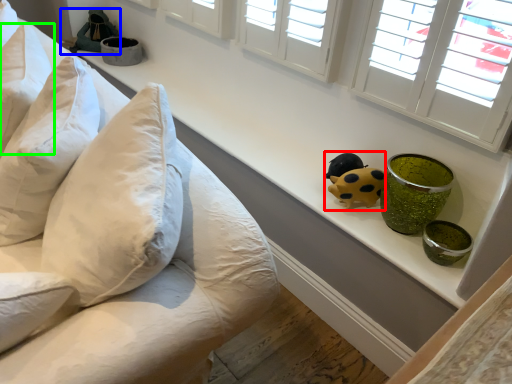
Question: Which is nearer to the toy (highlighted by a red box)? toy (highlighted by a blue box) or pillow (highlighted by a green box).

Choices:
 (A) toy
 (B) pillow

Answer: (B)